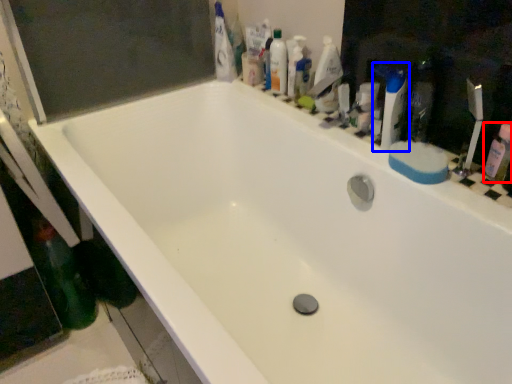
Question: Which object is further to the camera taking this photo, mouthwash (highlighted by a red box) or toiletry (highlighted by a blue box)?

Choices:
 (A) mouthwash
 (B) toiletry

Answer: (B)